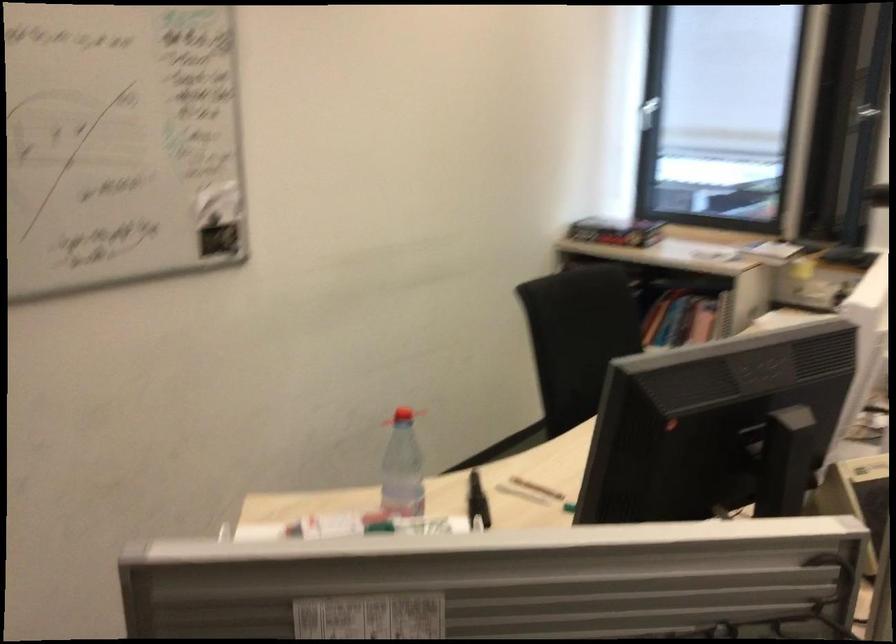
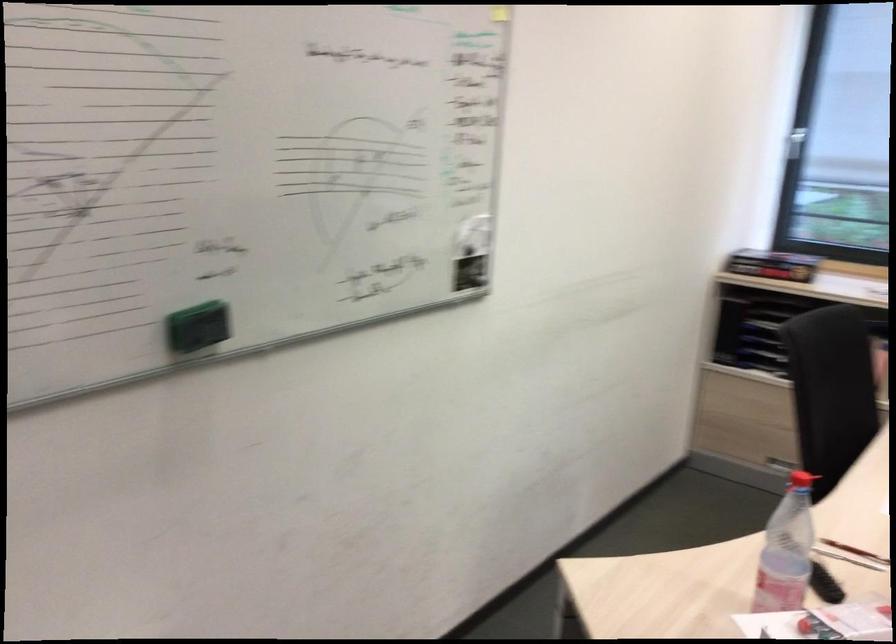
Question: In a continuous first-person perspective shot, in which direction is the camera moving?

Choices:
 (A) Left
 (B) Right
 (C) Forward
 (D) Backward

Answer: (A)